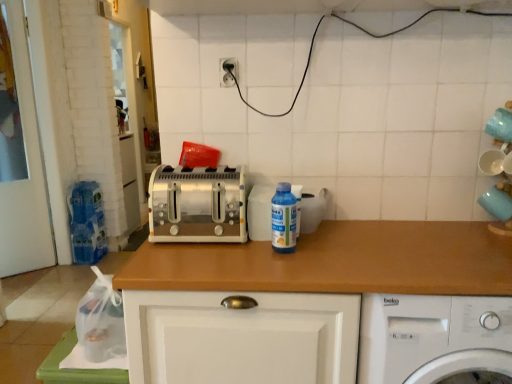
Question: Should I look upward or downward to see transparent plastic bottle at center?

Choices:
 (A) up
 (B) down

Answer: (B)

Question: Can you confirm if white plastic washing machine at lower right is shorter than wooden at center?

Choices:
 (A) no
 (B) yes

Answer: (B)

Question: Does white plastic washing machine at lower right appear on the right side of wooden at center?

Choices:
 (A) yes
 (B) no

Answer: (A)

Question: Is white plastic washing machine at lower right wider than wooden at center?

Choices:
 (A) yes
 (B) no

Answer: (A)

Question: Is white plastic washing machine at lower right outside wooden at center?

Choices:
 (A) yes
 (B) no

Answer: (A)

Question: Is wooden at center completely or partially inside white plastic washing machine at lower right?

Choices:
 (A) yes
 (B) no

Answer: (B)

Question: Are white plastic washing machine at lower right and wooden at center far apart?

Choices:
 (A) no
 (B) yes

Answer: (A)

Question: Is satin silver toaster at center at the left side of white plastic electric outlet at upper center?

Choices:
 (A) no
 (B) yes

Answer: (B)

Question: Does satin silver toaster at center have a greater width compared to white plastic electric outlet at upper center?

Choices:
 (A) yes
 (B) no

Answer: (A)

Question: Is satin silver toaster at center bigger than white plastic electric outlet at upper center?

Choices:
 (A) yes
 (B) no

Answer: (A)

Question: Is the depth of satin silver toaster at center less than that of white plastic electric outlet at upper center?

Choices:
 (A) no
 (B) yes

Answer: (B)

Question: Could you tell me if satin silver toaster at center is turned towards white plastic electric outlet at upper center?

Choices:
 (A) yes
 (B) no

Answer: (B)

Question: Is white plastic electric outlet at upper center at the back of satin silver toaster at center?

Choices:
 (A) no
 (B) yes

Answer: (A)

Question: Considering the relative positions of wooden at center and white plastic electric outlet at upper center in the image provided, is wooden at center in front of white plastic electric outlet at upper center?

Choices:
 (A) yes
 (B) no

Answer: (A)